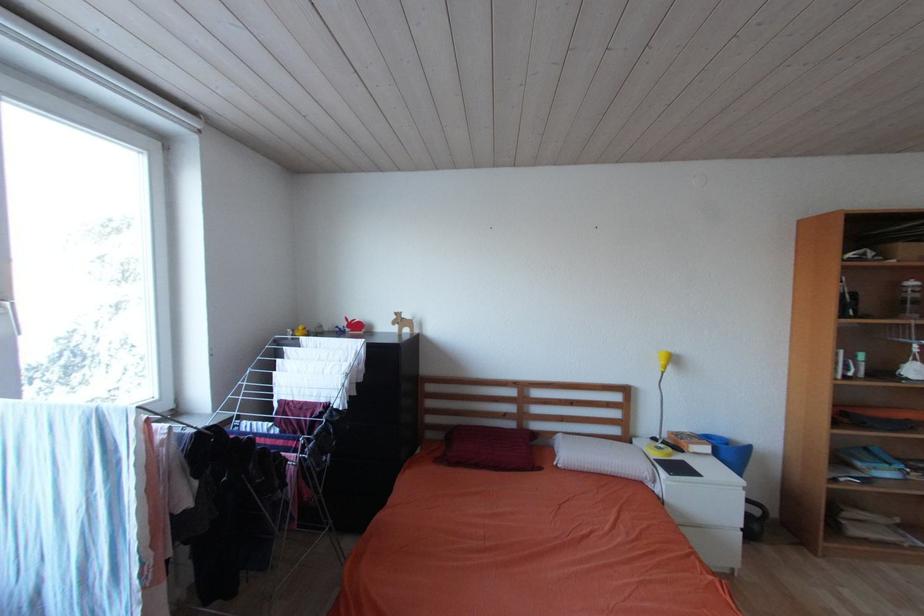
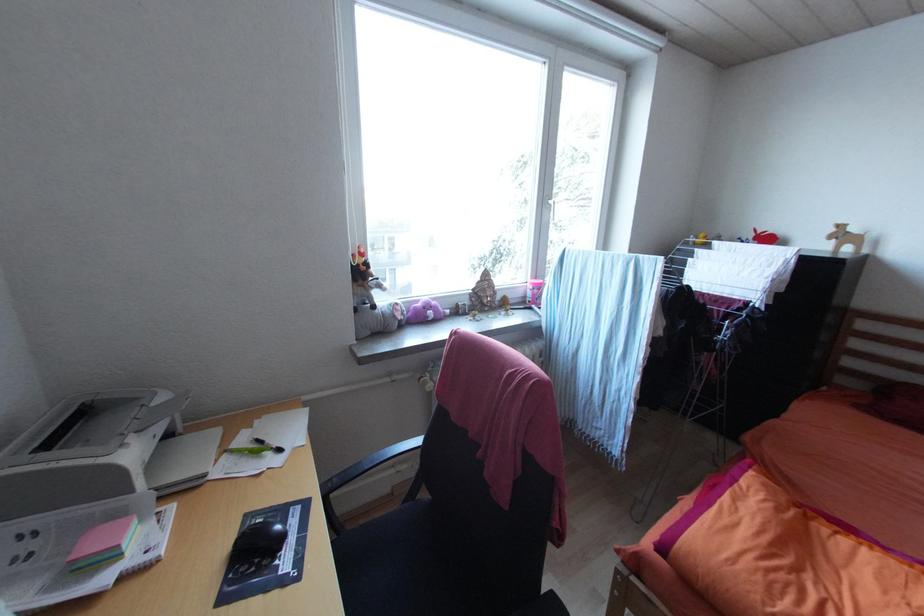
Question: The first image is from the beginning of the video and the second image is from the end. How did the camera likely rotate when shooting the video?

Choices:
 (A) Left
 (B) Right
 (C) Up
 (D) Down

Answer: (A)